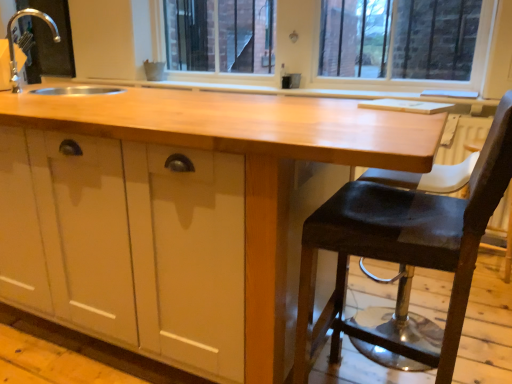
Question: Would you consider silver metallic faucet at upper left to be distant from glossy wood countertop at center?

Choices:
 (A) yes
 (B) no

Answer: (B)

Question: Can you confirm if silver metallic faucet at upper left is bigger than glossy wood countertop at center?

Choices:
 (A) no
 (B) yes

Answer: (A)

Question: From the image's perspective, is silver metallic faucet at upper left on glossy wood countertop at center?

Choices:
 (A) no
 (B) yes

Answer: (B)

Question: From the image's perspective, is silver metallic faucet at upper left under glossy wood countertop at center?

Choices:
 (A) no
 (B) yes

Answer: (A)

Question: Is silver metallic faucet at upper left to the right of glossy wood countertop at center from the viewer's perspective?

Choices:
 (A) yes
 (B) no

Answer: (B)

Question: Is point pos(374,203) positioned closer to the camera than point pos(251,180)?

Choices:
 (A) farther
 (B) closer

Answer: (A)

Question: Would you say dark brown leather stool at right is to the left or to the right of glossy wood countertop at center in the picture?

Choices:
 (A) left
 (B) right

Answer: (B)

Question: Is dark brown leather stool at right in front of or behind glossy wood countertop at center in the image?

Choices:
 (A) behind
 (B) front

Answer: (B)

Question: From a real-world perspective, is dark brown leather stool at right above or below glossy wood countertop at center?

Choices:
 (A) below
 (B) above

Answer: (B)

Question: Would you say glossy wood countertop at center is inside or outside dark brown leather stool at right?

Choices:
 (A) inside
 (B) outside

Answer: (B)

Question: Based on their sizes in the image, would you say glossy wood countertop at center is bigger or smaller than dark brown leather stool at right?

Choices:
 (A) big
 (B) small

Answer: (A)

Question: Looking at their shapes, would you say glossy wood countertop at center is wider or thinner than dark brown leather stool at right?

Choices:
 (A) wide
 (B) thin

Answer: (A)

Question: In terms of height, does glossy wood countertop at center look taller or shorter compared to dark brown leather stool at right?

Choices:
 (A) tall
 (B) short

Answer: (B)

Question: Based on their sizes in the image, would you say dark brown leather stool at right is bigger or smaller than silver metallic faucet at upper left?

Choices:
 (A) small
 (B) big

Answer: (B)

Question: Do you think dark brown leather stool at right is within silver metallic faucet at upper left, or outside of it?

Choices:
 (A) inside
 (B) outside

Answer: (B)